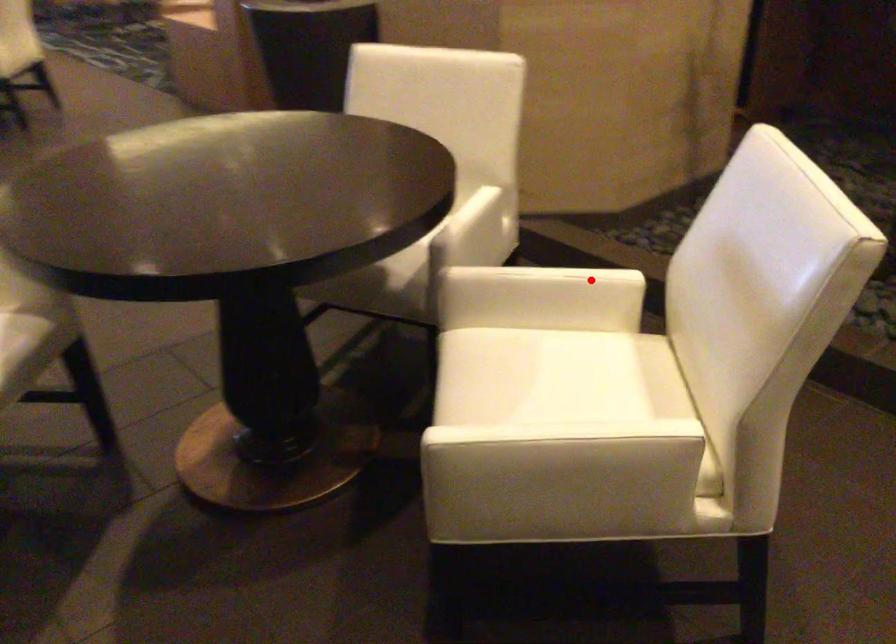
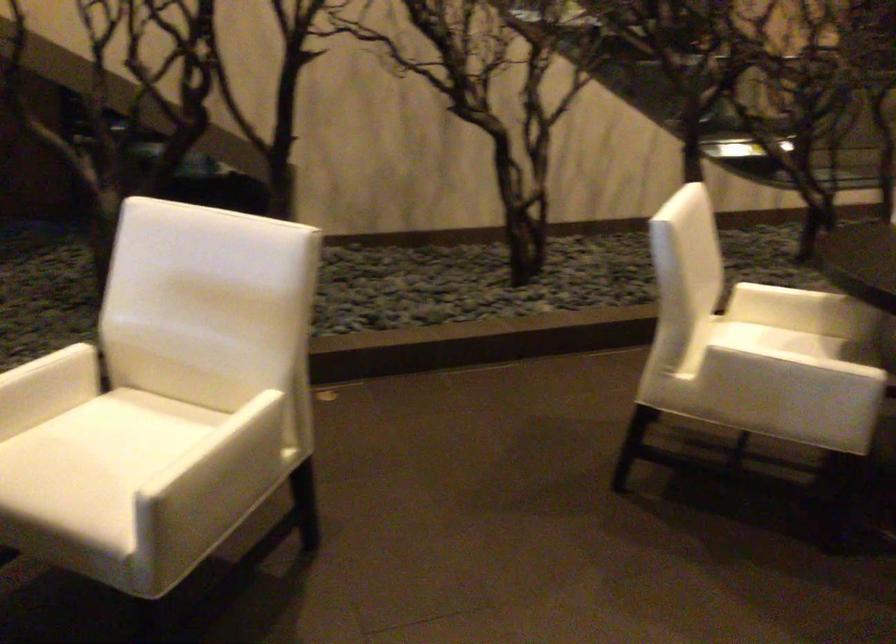
The point at the highlighted location is marked in the first image. Where is the corresponding point in the second image?

(58, 362)